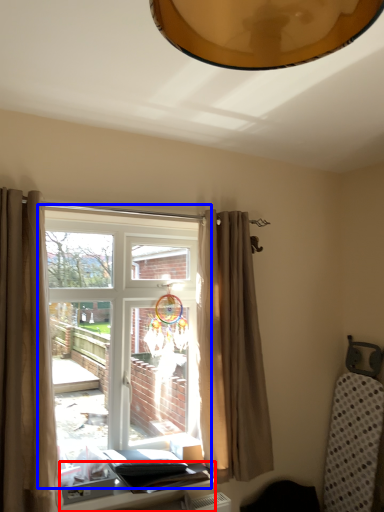
Question: Among these objects, which one is nearest to the camera, table (highlighted by a red box) or window (highlighted by a blue box)?

Choices:
 (A) table
 (B) window

Answer: (A)